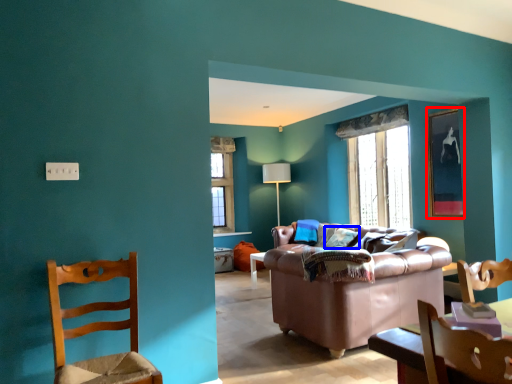
Question: Which point is closer to the camera, picture frame (highlighted by a red box) or pillow (highlighted by a blue box)?

Choices:
 (A) picture frame
 (B) pillow

Answer: (A)